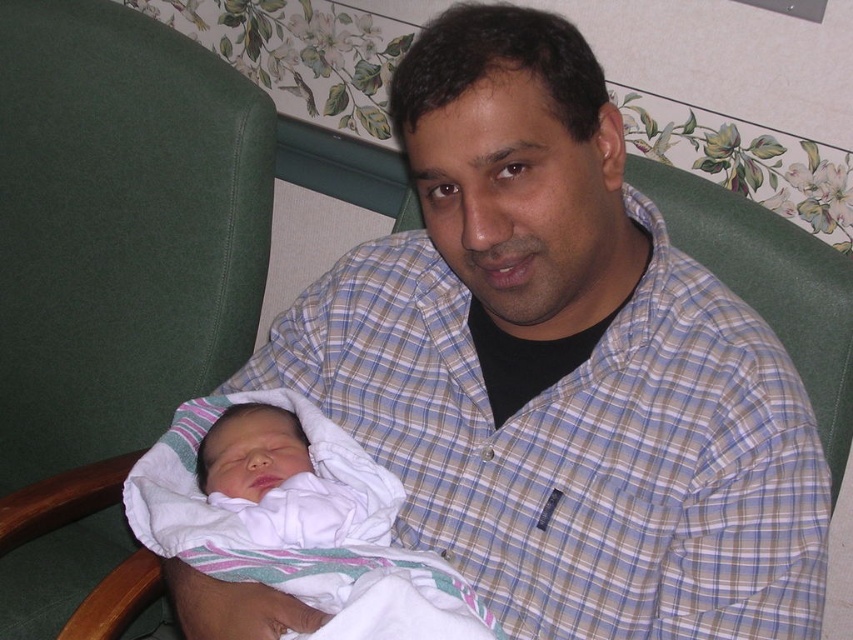
Looking at this image, can you confirm if green fabric swivel chair at left is positioned to the right of white soft cloth at center?

In fact, green fabric swivel chair at left is to the left of white soft cloth at center.

Who is shorter, green fabric swivel chair at left or white soft cloth at center?

white soft cloth at center

This screenshot has width=853, height=640. What do you see at coordinates (119, 228) in the screenshot? I see `green fabric swivel chair at left` at bounding box center [119, 228].

The width and height of the screenshot is (853, 640). In order to click on green fabric swivel chair at left in this screenshot , I will do `click(119, 228)`.